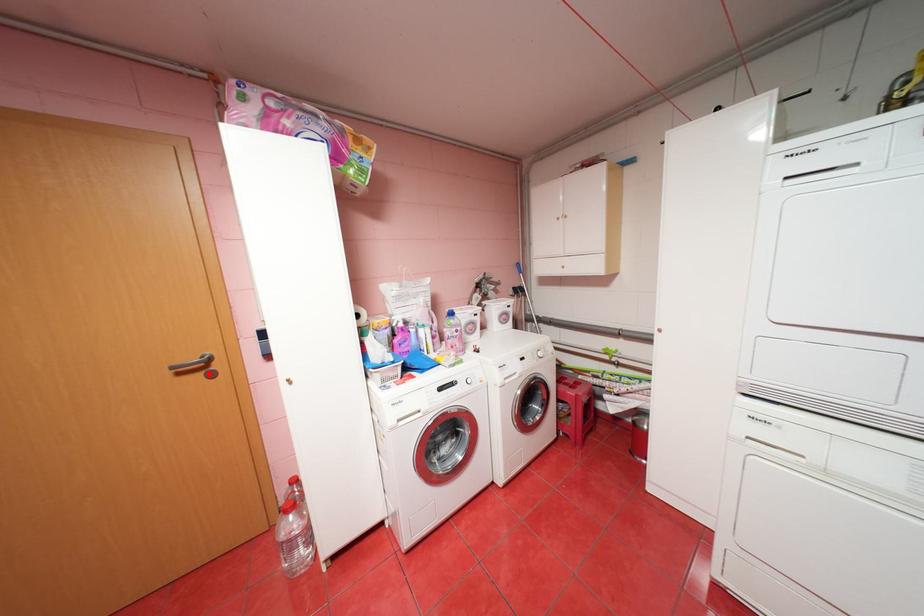
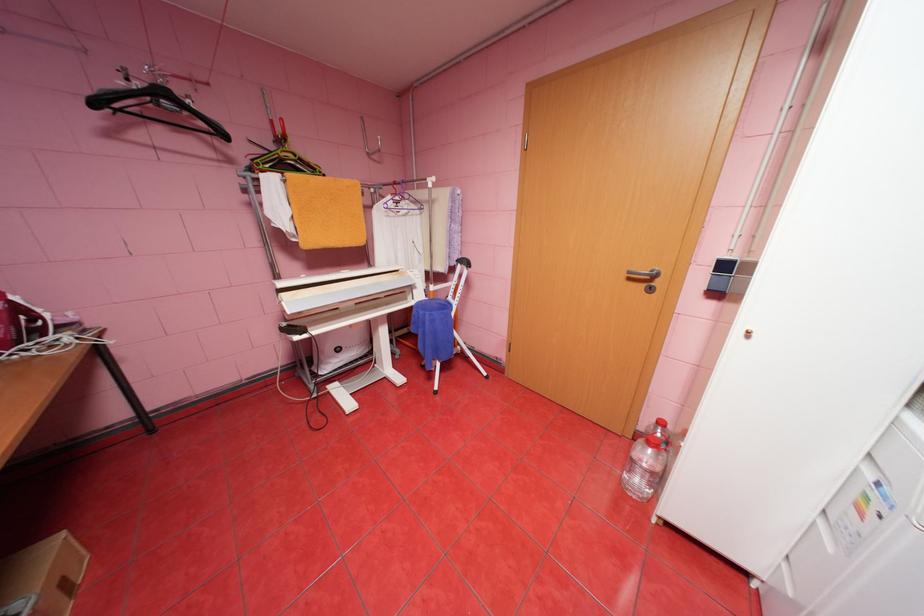
The point at the highlighted location is marked in the first image. Where is the corresponding point in the second image?

(650, 285)